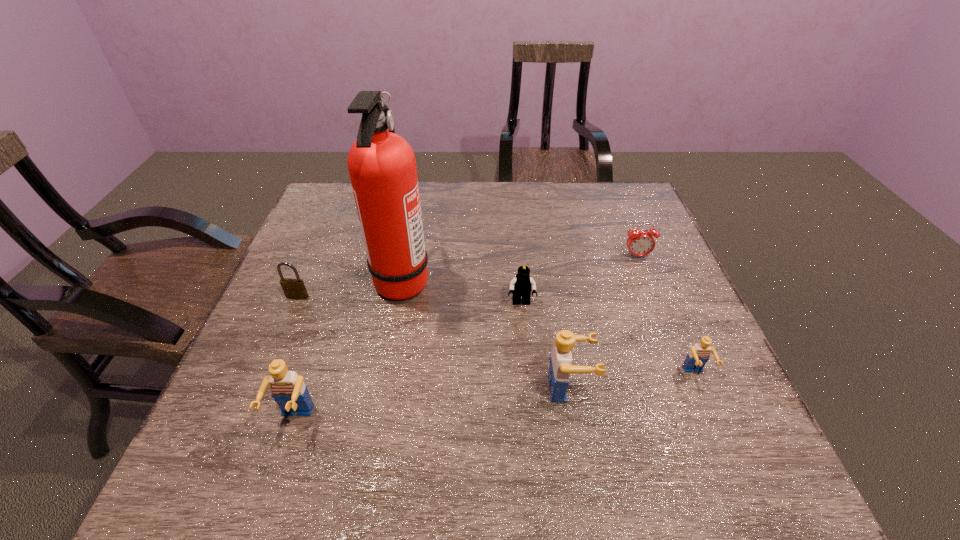
Find the location of `vacant region that satisfies the following two spatial constraints: 1. on the handle side of the fifth object from right to left; 2. on the front side of the leftmost object`. vacant region that satisfies the following two spatial constraints: 1. on the handle side of the fifth object from right to left; 2. on the front side of the leftmost object is located at coordinates (399, 296).

The height and width of the screenshot is (540, 960). Identify the location of free space that satisfies the following two spatial constraints: 1. on the face of the alarm clock; 2. on the face of the third object from right to left. (690, 388).

Locate an element on the screen. Image resolution: width=960 pixels, height=540 pixels. vacant space that satisfies the following two spatial constraints: 1. on the face of the second Lego from right to left; 2. on the face of the leftmost Lego is located at coordinates (574, 420).

This screenshot has width=960, height=540. I want to click on vacant space that satisfies the following two spatial constraints: 1. on the face of the third object from right to left; 2. on the face of the fifth shortest object, so click(574, 420).

I want to click on vacant point that satisfies the following two spatial constraints: 1. on the handle side of the third object from left to right; 2. on the face of the fifth shortest object, so click(376, 420).